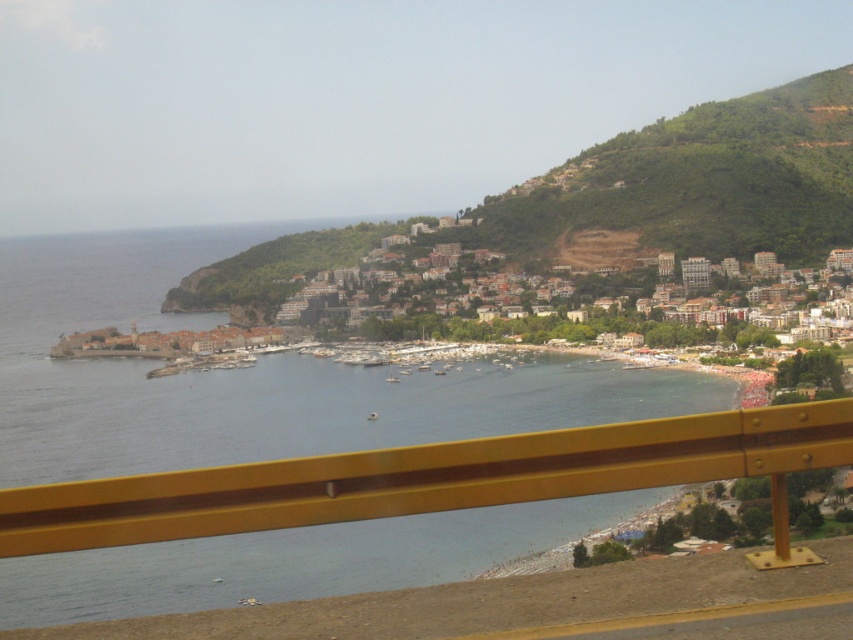
Which is below, yellow metallic rail at lower center or brown stone buildings at center?

yellow metallic rail at lower center is lower down.

Consider the image. Does yellow metallic rail at lower center have a greater height compared to brown stone buildings at center?

No, yellow metallic rail at lower center is not taller than brown stone buildings at center.

Where is `yellow metallic rail at lower center`? The image size is (853, 640). yellow metallic rail at lower center is located at coordinates (431, 477).

Find the location of a particular element. yellow metallic rail at lower center is located at coordinates (431, 477).